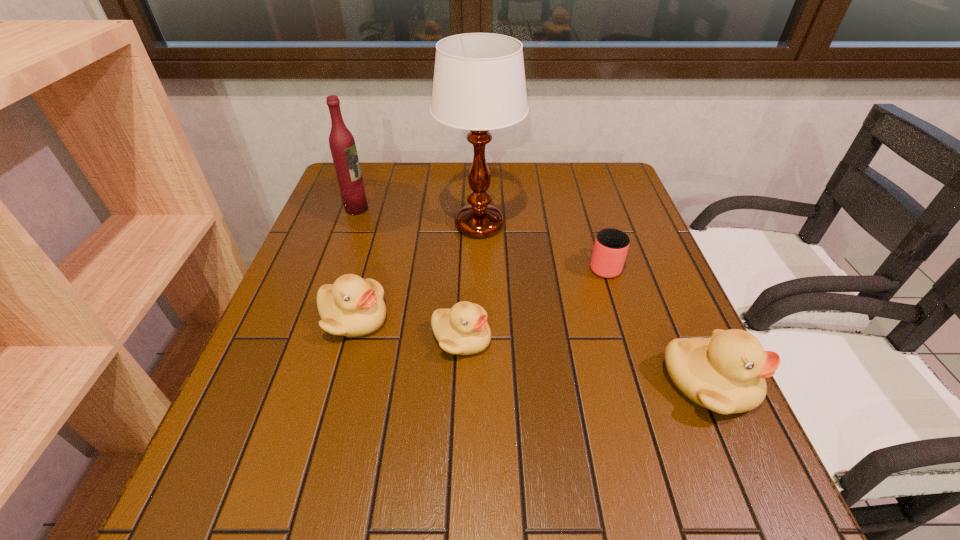
Please point a location where one more duckling can be added evenly. Please provide its 2D coordinates. Your answer should be formatted as a tuple, i.e. [(x, y)], where the tuple contains the x and y coordinates of a point satisfying the conditions above.

[(579, 360)]